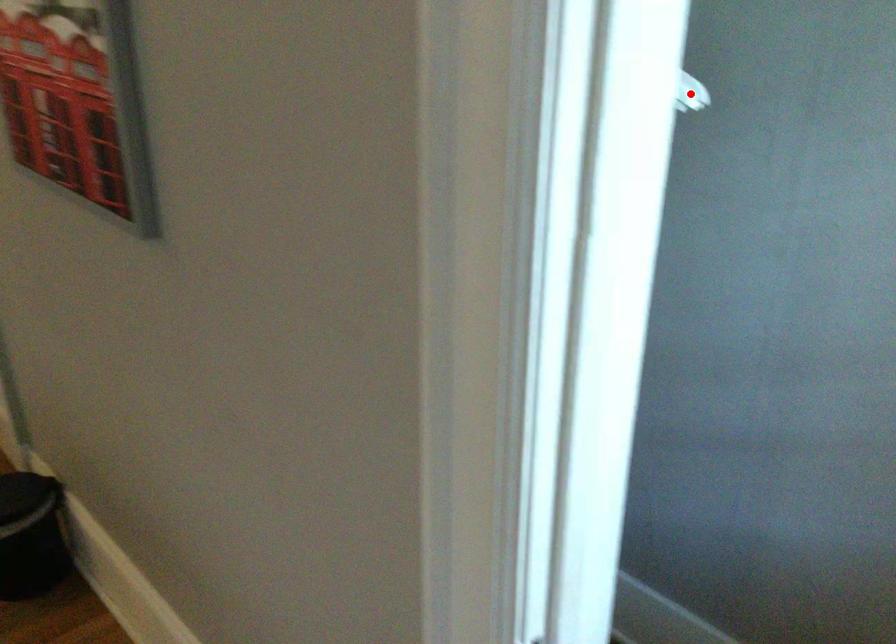
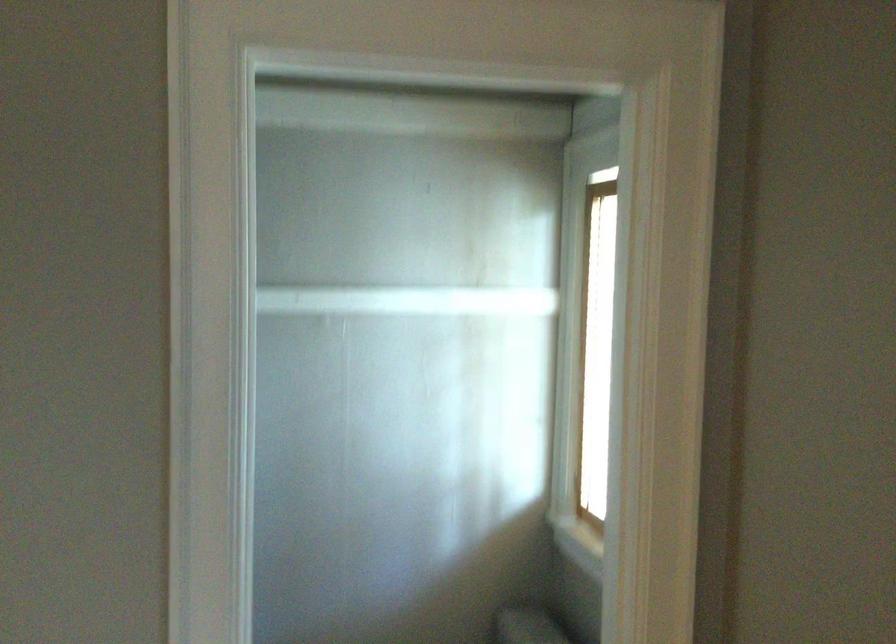
Question: I am providing you with two images of the same scene from different viewpoints. A red point is marked on the first image. At the location where the point appears in image 1, is it still visible in image 2?

Choices:
 (A) Yes
 (B) No

Answer: (B)